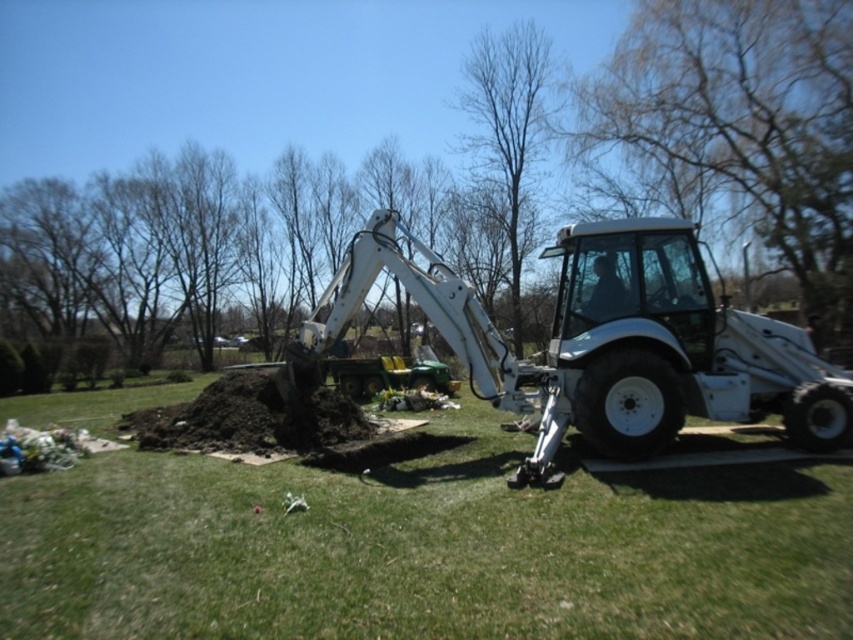
Question: Is bare branches at upper right below bare branches at center?

Choices:
 (A) yes
 (B) no

Answer: (A)

Question: Which of these objects is positioned closest to the green grass at center?

Choices:
 (A) brown leafless tree at center
 (B) bare branches at center
 (C) bare branches at upper right
 (D) white matte tractor at center

Answer: (D)

Question: Which object appears closest to the camera in this image?

Choices:
 (A) white matte tractor at center
 (B) bare branches at center
 (C) green grass at center
 (D) bare branches at upper right

Answer: (C)

Question: Does brown leafless tree at center have a greater width compared to bare branches at center?

Choices:
 (A) no
 (B) yes

Answer: (B)

Question: Does green grass at center appear under bare branches at upper right?

Choices:
 (A) yes
 (B) no

Answer: (A)

Question: Based on their relative distances, which object is farther from the white matte tractor at center?

Choices:
 (A) bare branches at center
 (B) brown leafless tree at center

Answer: (B)